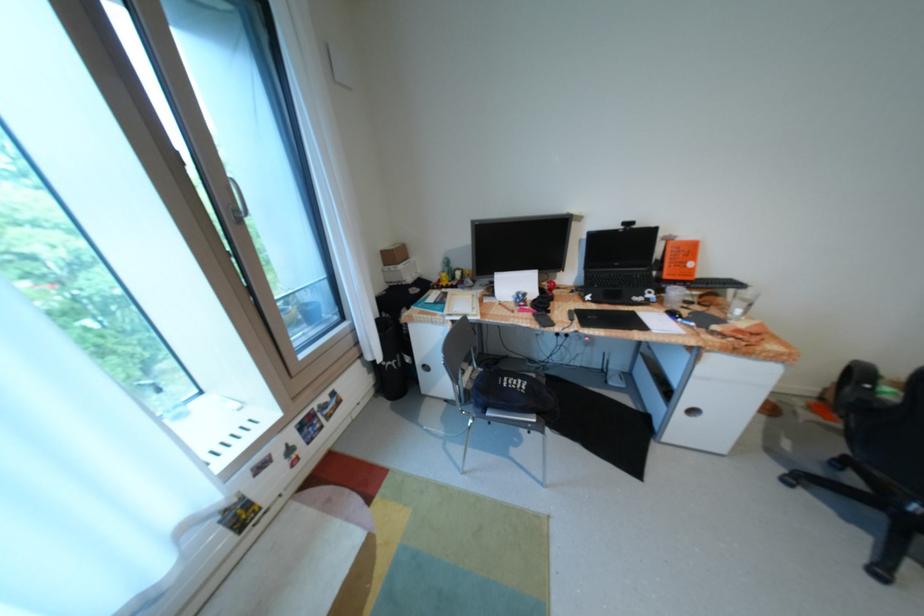
This screenshot has height=616, width=924. In order to click on chair sitting surface in this screenshot , I will do `click(901, 448)`.